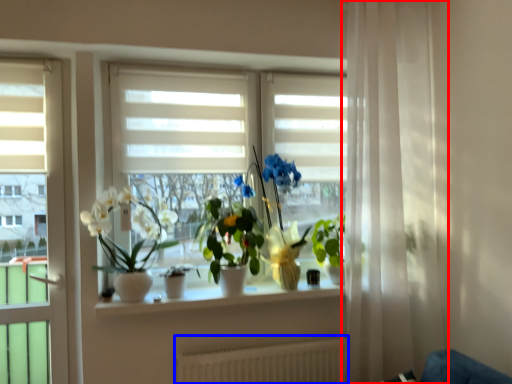
Question: Which object is closer to the camera taking this photo, curtain (highlighted by a red box) or radiator (highlighted by a blue box)?

Choices:
 (A) curtain
 (B) radiator

Answer: (A)